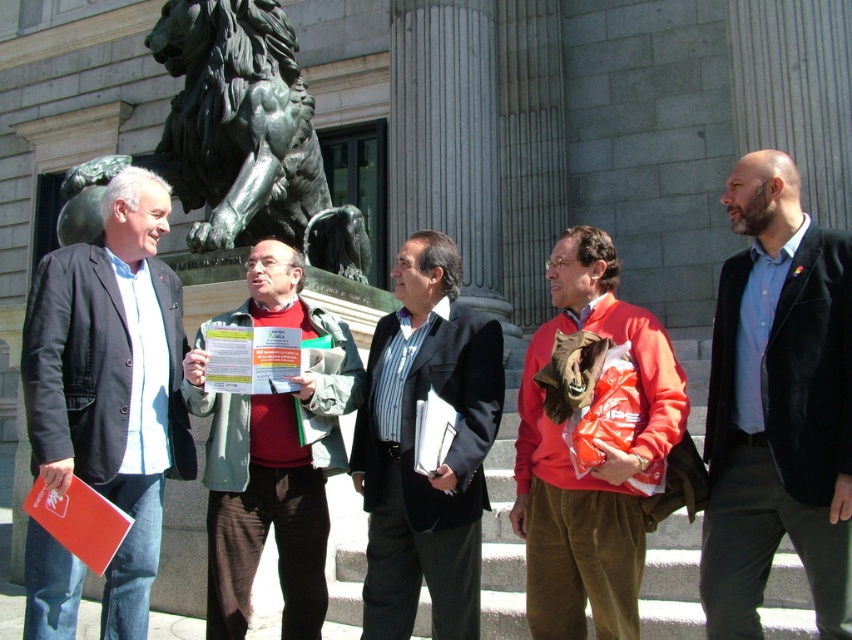
Question: Which point appears closest to the camera in this image?

Choices:
 (A) (430, 236)
 (B) (96, 307)
 (C) (723, 493)

Answer: (C)

Question: Based on their relative distances, which object is nearer to the orange cotton sweater at center?

Choices:
 (A) bronze statue at left
 (B) matte black jacket at left

Answer: (B)

Question: In this image, where is matte black jacket at left located relative to red sweater at center?

Choices:
 (A) left
 (B) right

Answer: (A)

Question: Can you confirm if blue cotton shirt at center is wider than bronze statue at left?

Choices:
 (A) yes
 (B) no

Answer: (B)

Question: Can you confirm if matte black jacket at left is positioned to the left of striped fabric shirt at center?

Choices:
 (A) no
 (B) yes

Answer: (B)

Question: Which of the following is the closest to the observer?

Choices:
 (A) striped fabric shirt at center
 (B) red sweater at center

Answer: (A)